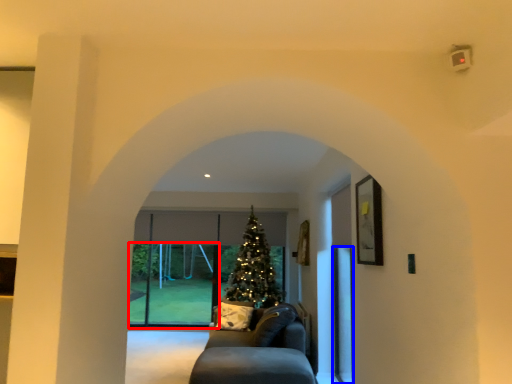
Question: Which object appears farthest to the camera in this image, glass door (highlighted by a red box) or screen door (highlighted by a blue box)?

Choices:
 (A) glass door
 (B) screen door

Answer: (A)